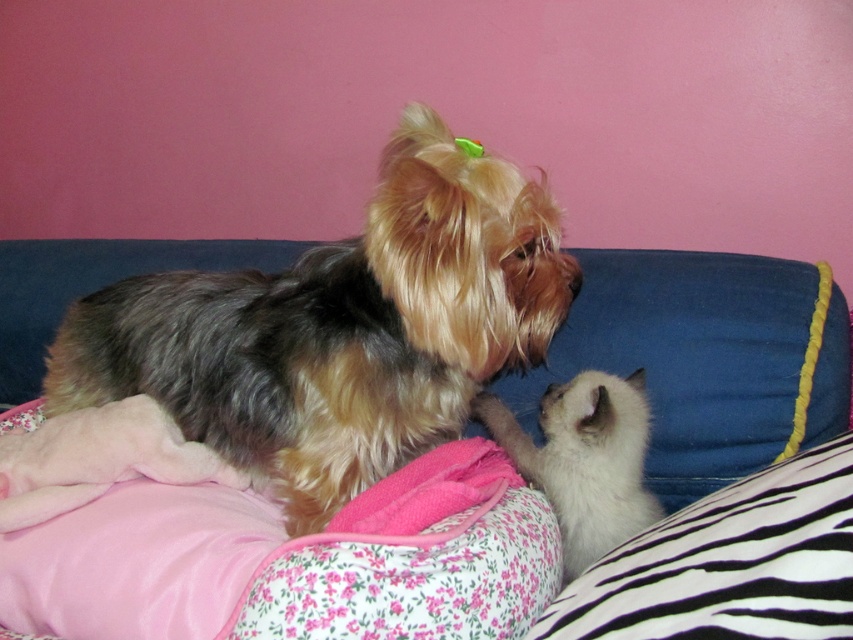
Question: Is shaggy brown dog at center positioned at the back of white fluffy cat at center?

Choices:
 (A) yes
 (B) no

Answer: (B)

Question: Among these points, which one is nearest to the camera?

Choices:
 (A) (554, 360)
 (B) (552, 460)

Answer: (B)

Question: Is blue fabric couch at center above white fluffy cat at center?

Choices:
 (A) yes
 (B) no

Answer: (A)

Question: Which is nearer to the blue fabric couch at center?

Choices:
 (A) white fluffy cat at center
 (B) shaggy brown dog at center

Answer: (A)

Question: Can you confirm if blue fabric couch at center is wider than white fluffy cat at center?

Choices:
 (A) yes
 (B) no

Answer: (A)

Question: Among these points, which one is nearest to the camera?

Choices:
 (A) (206, 296)
 (B) (694, 417)

Answer: (B)